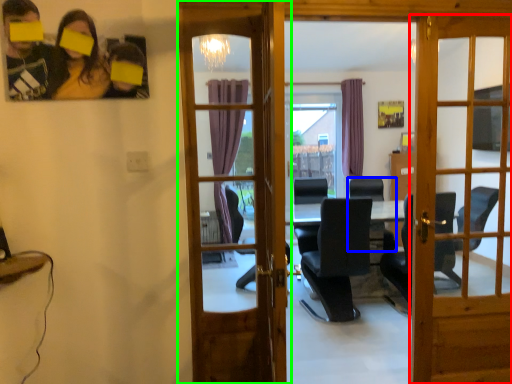
Question: Which object is positioned farthest from door (highlighted by a red box)? Select from chair (highlighted by a blue box) and door (highlighted by a green box).

Choices:
 (A) chair
 (B) door

Answer: (B)